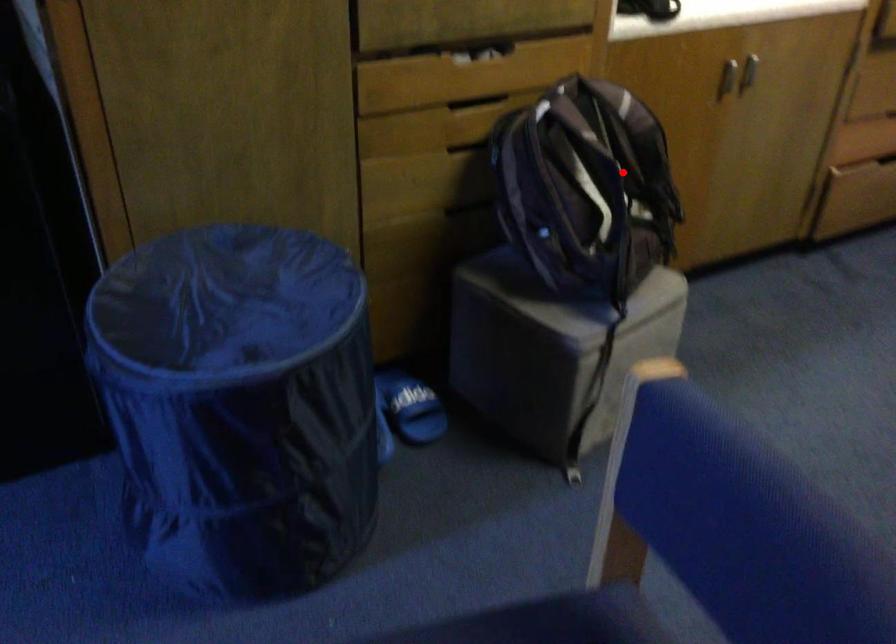
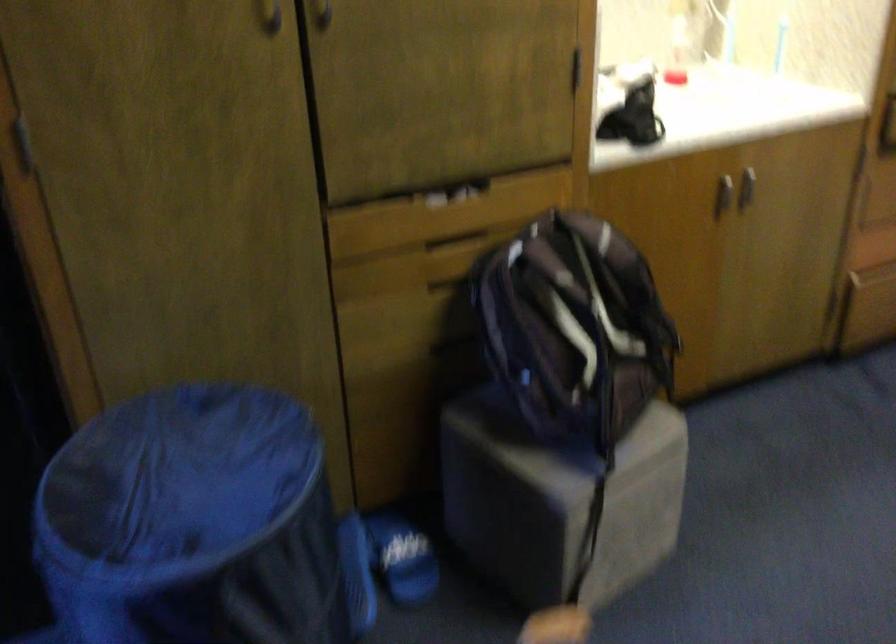
Where in the second image is the point corresponding to the highlighted location from the first image?

(607, 310)